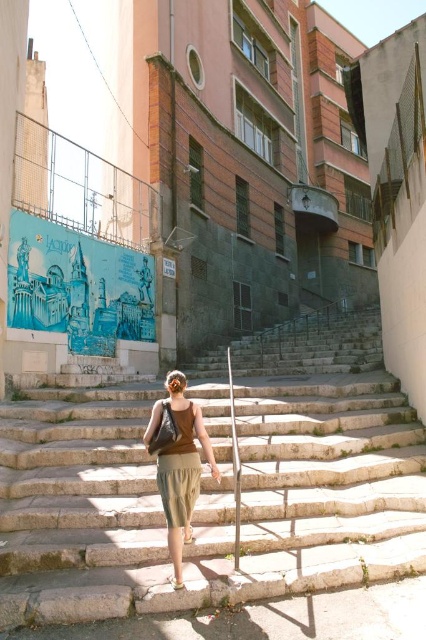
Question: Among these points, which one is nearest to the camera?

Choices:
 (A) (178, 461)
 (B) (175, 582)
 (C) (100, 403)
 (D) (186, 528)

Answer: (B)

Question: Can you confirm if olive green fabric skirt at center is bigger than beige fabric sandal at lower center?

Choices:
 (A) yes
 (B) no

Answer: (A)

Question: Estimate the real-world distances between objects in this image. Which object is farther from the brown leather sandal at lower center?

Choices:
 (A) stone steps at center
 (B) beige fabric sandal at lower center

Answer: (A)

Question: From the image, what is the correct spatial relationship of beige fabric sandal at lower center in relation to brown leather sandal at lower center?

Choices:
 (A) left
 (B) right

Answer: (B)

Question: Is olive green fabric skirt at center to the right of brown leather sandal at lower center from the viewer's perspective?

Choices:
 (A) yes
 (B) no

Answer: (A)

Question: Which point appears farthest from the camera in this image?

Choices:
 (A) (164, 468)
 (B) (62, 589)
 (C) (172, 579)
 (D) (192, 536)

Answer: (D)